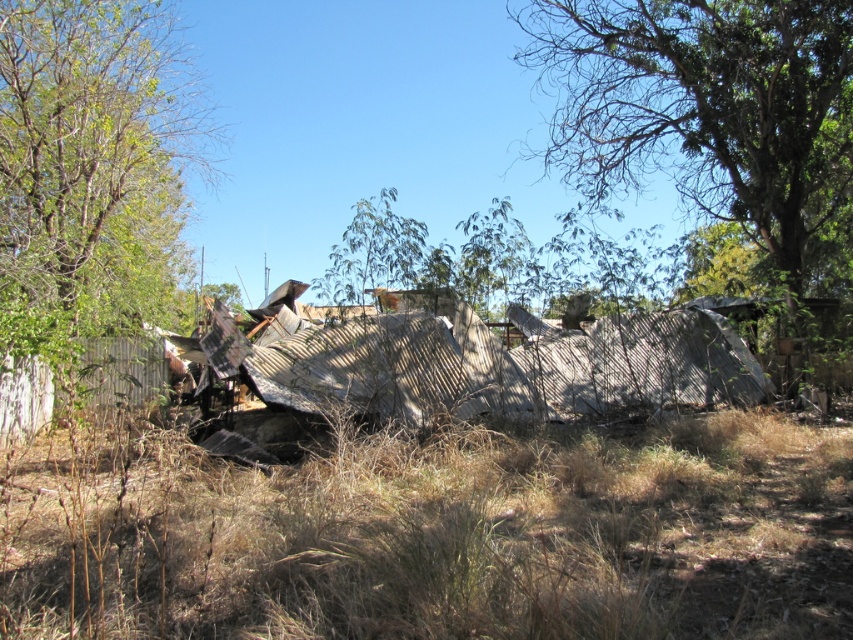
In the scene shown: Is green leafy tree at upper right below green leafy tree at left?

Incorrect, green leafy tree at upper right is not positioned below green leafy tree at left.

Can you confirm if green leafy tree at upper right is positioned to the right of green leafy tree at left?

Correct, you'll find green leafy tree at upper right to the right of green leafy tree at left.

Which is behind, point (846, 124) or point (126, 35)?

The point (846, 124) is behind.

In order to click on green leafy tree at upper right in this screenshot , I will do `click(705, 106)`.

Can you confirm if brown dry grass at center is wider than green leafy tree at upper right?

Correct, the width of brown dry grass at center exceeds that of green leafy tree at upper right.

Is brown dry grass at center below green leafy tree at upper right?

Indeed, brown dry grass at center is positioned under green leafy tree at upper right.

Is point (112, 611) closer to viewer compared to point (558, 163)?

Yes.

I want to click on brown dry grass at center, so click(x=438, y=534).

Is brown dry grass at center to the right of corrugated metal hut at center from the viewer's perspective?

Yes, brown dry grass at center is to the right of corrugated metal hut at center.

Which is above, brown dry grass at center or corrugated metal hut at center?

corrugated metal hut at center is higher up.

Is point (732, 552) positioned in front of point (422, 332)?

Yes.

You are a GUI agent. You are given a task and a screenshot of the screen. Output one action in this format:
    pyautogui.click(x=<x>, y=<y>)
    Task: Click on the brown dry grass at center
    
    Given the screenshot: What is the action you would take?
    pyautogui.click(x=438, y=534)